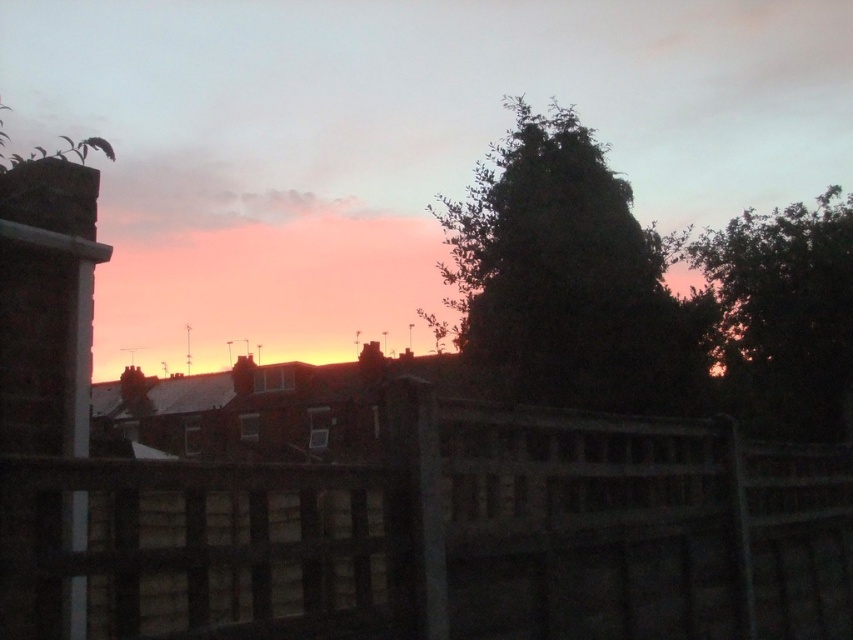
You are standing in the urban scene and want to determine which of the two points, point (x=598, y=596) or point (x=482, y=228), is nearer to you. Based on the scene, which one is closer?

Point (x=598, y=596) is closer to the viewer than point (x=482, y=228).